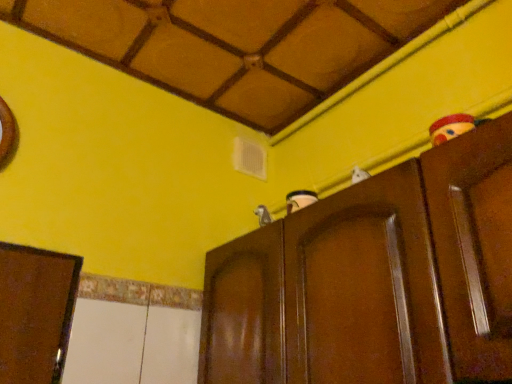
Question: Looking at their shapes, would you say brown glossy door at upper right is wider or thinner than brown wooden cupboard at upper center?

Choices:
 (A) wide
 (B) thin

Answer: (B)

Question: Considering the positions of brown glossy door at upper right and brown wooden cupboard at upper center in the image, is brown glossy door at upper right taller or shorter than brown wooden cupboard at upper center?

Choices:
 (A) tall
 (B) short

Answer: (B)

Question: Based on their sizes in the image, would you say brown glossy door at upper right is bigger or smaller than brown wooden cupboard at upper center?

Choices:
 (A) small
 (B) big

Answer: (A)

Question: Based on their sizes in the image, would you say brown wooden cupboard at upper center is bigger or smaller than brown glossy door at upper right?

Choices:
 (A) big
 (B) small

Answer: (A)

Question: Considering the positions of brown wooden cupboard at upper center and brown glossy door at upper right in the image, is brown wooden cupboard at upper center wider or thinner than brown glossy door at upper right?

Choices:
 (A) thin
 (B) wide

Answer: (B)

Question: From a real-world perspective, relative to brown glossy door at upper right, is brown wooden cupboard at upper center vertically above or below?

Choices:
 (A) below
 (B) above

Answer: (A)

Question: Visually, is brown wooden cupboard at upper center positioned to the left or to the right of brown glossy door at upper right?

Choices:
 (A) right
 (B) left

Answer: (B)